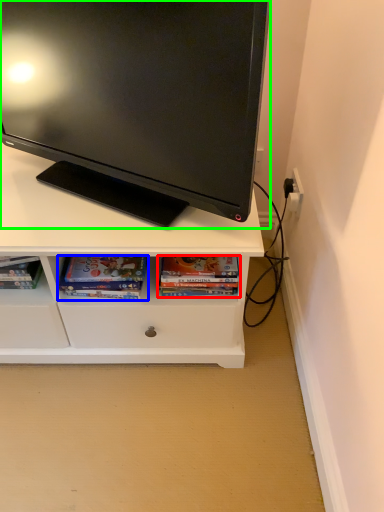
Question: Considering the real-world distances, which object is closest to book (highlighted by a red box)? book (highlighted by a blue box) or television (highlighted by a green box).

Choices:
 (A) book
 (B) television

Answer: (A)